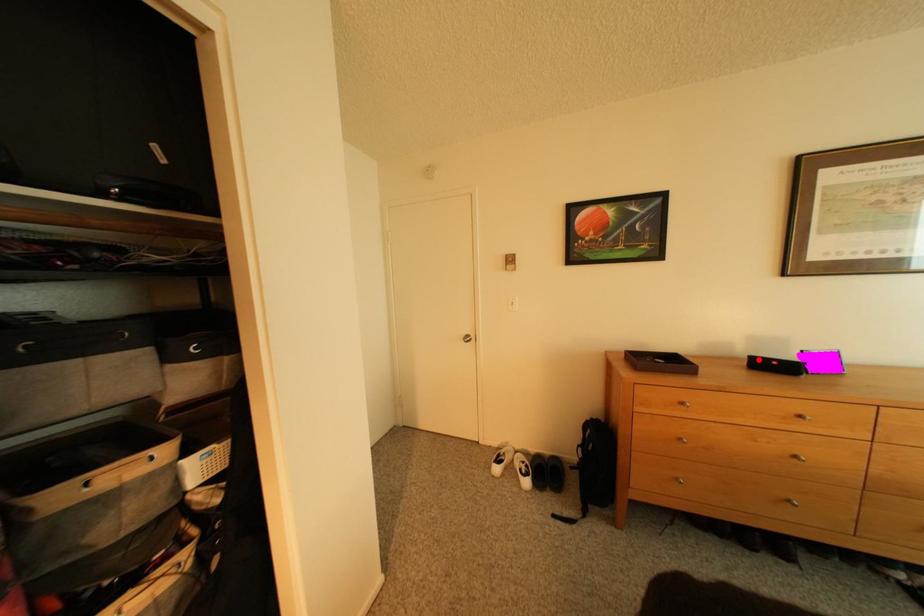
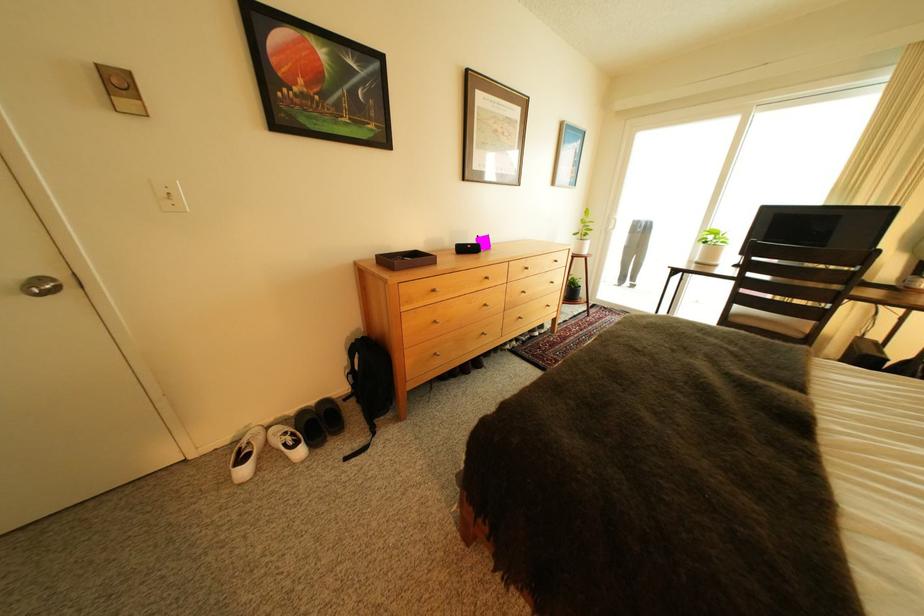
Locate, in the second image, the point that corresponds to the highlighted location in the first image.

(467, 248)